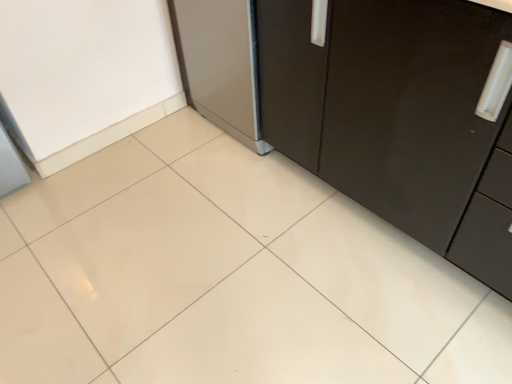
I want to click on satin silver refrigerator at center, so click(x=220, y=64).

Describe the element at coordinates (220, 64) in the screenshot. The width and height of the screenshot is (512, 384). I see `satin silver refrigerator at center` at that location.

What do you see at coordinates (398, 117) in the screenshot? The width and height of the screenshot is (512, 384). I see `matte black cabinet at center` at bounding box center [398, 117].

You are a GUI agent. You are given a task and a screenshot of the screen. Output one action in this format:
    pyautogui.click(x=<x>, y=<y>)
    Task: Click on the matte black cabinet at center
    This screenshot has width=512, height=384.
    Given the screenshot: What is the action you would take?
    pyautogui.click(x=398, y=117)

The image size is (512, 384). I want to click on satin silver refrigerator at center, so click(x=220, y=64).

Which is more to the right, satin silver refrigerator at center or matte black cabinet at center?

matte black cabinet at center is more to the right.

Considering their positions, is satin silver refrigerator at center located in front of or behind matte black cabinet at center?

Clearly, satin silver refrigerator at center is behind matte black cabinet at center.

Between point (191, 40) and point (279, 85), which one is positioned in front?

The point (279, 85) is in front.

From the image's perspective, is satin silver refrigerator at center positioned above or below matte black cabinet at center?

satin silver refrigerator at center is above matte black cabinet at center.

From a real-world perspective, is satin silver refrigerator at center on matte black cabinet at center?

Actually, satin silver refrigerator at center is physically below matte black cabinet at center in the real world.

Can you confirm if satin silver refrigerator at center is thinner than matte black cabinet at center?

Yes.

Considering the relative sizes of satin silver refrigerator at center and matte black cabinet at center in the image provided, is satin silver refrigerator at center taller than matte black cabinet at center?

In fact, satin silver refrigerator at center may be shorter than matte black cabinet at center.

Considering the relative sizes of satin silver refrigerator at center and matte black cabinet at center in the image provided, is satin silver refrigerator at center smaller than matte black cabinet at center?

Correct, satin silver refrigerator at center occupies less space than matte black cabinet at center.

Is satin silver refrigerator at center surrounding matte black cabinet at center?

No, matte black cabinet at center is not surrounded by satin silver refrigerator at center.

Is satin silver refrigerator at center not close to matte black cabinet at center?

They are positioned close to each other.

Is satin silver refrigerator at center facing away from matte black cabinet at center?

satin silver refrigerator at center is not turned away from matte black cabinet at center.

Can you tell me how much satin silver refrigerator at center and matte black cabinet at center differ in facing direction?

0.000199 degrees separate the facing orientations of satin silver refrigerator at center and matte black cabinet at center.

This screenshot has height=384, width=512. I want to click on appliance that appears behind the matte black cabinet at center, so click(x=220, y=64).

Between matte black cabinet at center and satin silver refrigerator at center, which one appears on the left side from the viewer's perspective?

satin silver refrigerator at center.

Between matte black cabinet at center and satin silver refrigerator at center, which one is positioned behind?

satin silver refrigerator at center is more distant.

Does point (466, 156) come farther from viewer compared to point (224, 44)?

No, (466, 156) is closer to viewer.

From the image's perspective, is matte black cabinet at center under satin silver refrigerator at center?

Yes, from the image's perspective, matte black cabinet at center is below satin silver refrigerator at center.

From a real-world perspective, does matte black cabinet at center sit lower than satin silver refrigerator at center?

No, from a real-world perspective, matte black cabinet at center is not under satin silver refrigerator at center.

Considering the sizes of objects matte black cabinet at center and satin silver refrigerator at center in the image provided, who is wider, matte black cabinet at center or satin silver refrigerator at center?

matte black cabinet at center is wider.

Considering the sizes of matte black cabinet at center and satin silver refrigerator at center in the image, is matte black cabinet at center taller or shorter than satin silver refrigerator at center?

matte black cabinet at center is taller than satin silver refrigerator at center.

Does matte black cabinet at center have a larger size compared to satin silver refrigerator at center?

Correct, matte black cabinet at center is larger in size than satin silver refrigerator at center.

Is satin silver refrigerator at center located within matte black cabinet at center?

No, satin silver refrigerator at center is not inside matte black cabinet at center.

Is matte black cabinet at center positioned far away from satin silver refrigerator at center?

No, matte black cabinet at center is in close proximity to satin silver refrigerator at center.

Could you tell me if matte black cabinet at center is facing satin silver refrigerator at center?

No, matte black cabinet at center does not turn towards satin silver refrigerator at center.

In the scene shown: How different are the orientations of matte black cabinet at center and satin silver refrigerator at center in degrees?

0.000199 degrees separate the facing orientations of matte black cabinet at center and satin silver refrigerator at center.

Consider the image. Measure the distance from matte black cabinet at center to satin silver refrigerator at center.

matte black cabinet at center and satin silver refrigerator at center are 17.66 inches apart.

In the image, there is a satin silver refrigerator at center. In order to click on cabinetry below it (from the image's perspective) in this screenshot , I will do `click(398, 117)`.

The width and height of the screenshot is (512, 384). I want to click on cabinetry below the satin silver refrigerator at center (from the image's perspective), so click(x=398, y=117).

Where is `cabinetry in front of the satin silver refrigerator at center`? The height and width of the screenshot is (384, 512). cabinetry in front of the satin silver refrigerator at center is located at coordinates (398, 117).